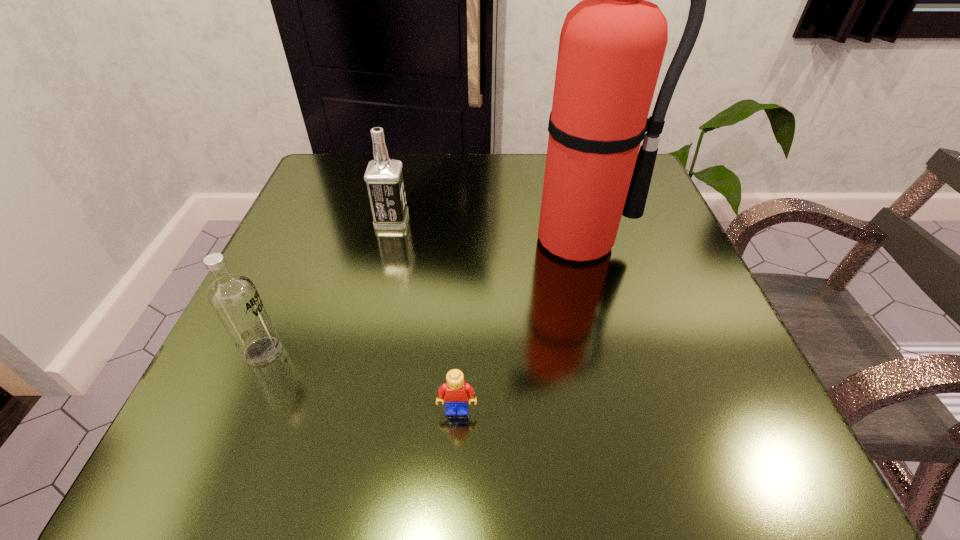
Locate an element on the screen. vacant space located 0.330m on the front label of the second nearest object is located at coordinates (502, 352).

Identify the location of vacant region located on the front-facing side of the nearest object. (456, 454).

The width and height of the screenshot is (960, 540). Identify the location of object that is positioned at the far edge. (384, 178).

Locate an element on the screen. The height and width of the screenshot is (540, 960). object that is at the near edge is located at coordinates (455, 391).

You are a GUI agent. You are given a task and a screenshot of the screen. Output one action in this format:
    pyautogui.click(x=<x>, y=<y>)
    Task: Click on the object that is at the left edge
    This screenshot has width=960, height=540.
    Given the screenshot: What is the action you would take?
    pyautogui.click(x=233, y=297)

At what (x,y) coordinates should I click in order to perform the action: click on object that is at the right edge. Please return your answer as a coordinate pair (x, y). Looking at the image, I should click on (612, 43).

The width and height of the screenshot is (960, 540). In the image, there is a desktop. Identify the location of free space at the far edge. (392, 157).

The height and width of the screenshot is (540, 960). I want to click on vacant point at the near edge, so click(505, 427).

Identify the location of vacant area at the left edge. The width and height of the screenshot is (960, 540). (291, 220).

Image resolution: width=960 pixels, height=540 pixels. In the image, there is a desktop. Find the location of `free space at the right edge`. free space at the right edge is located at coordinates tap(669, 264).